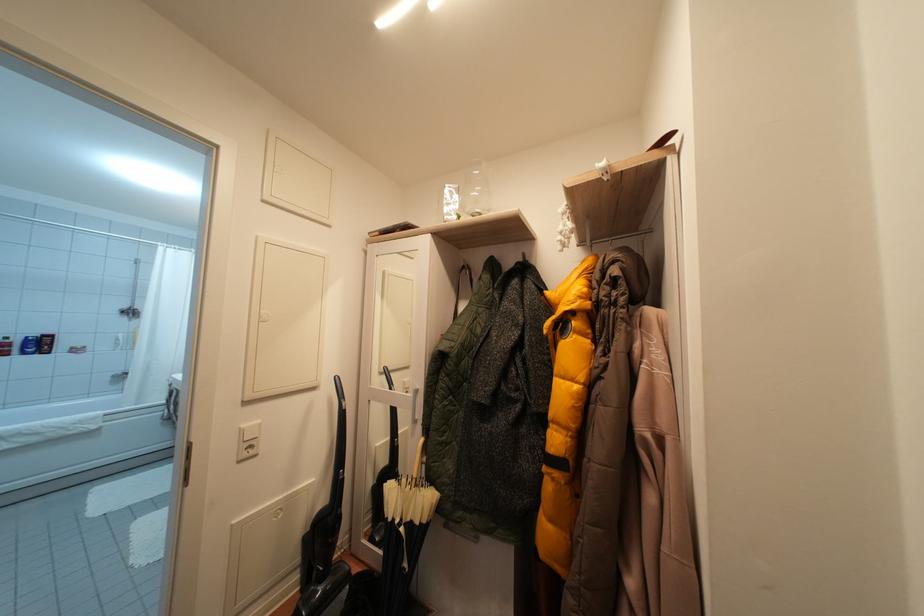
This screenshot has height=616, width=924. Find the location of `cream umbrella handle`. cream umbrella handle is located at coordinates (417, 464).